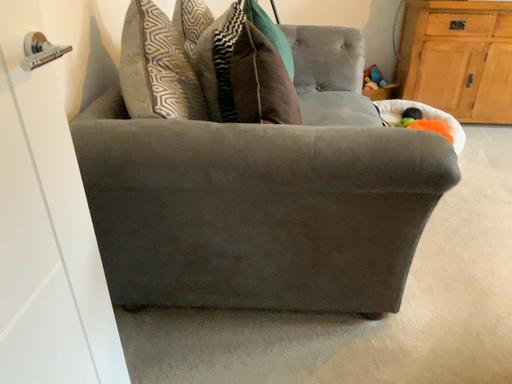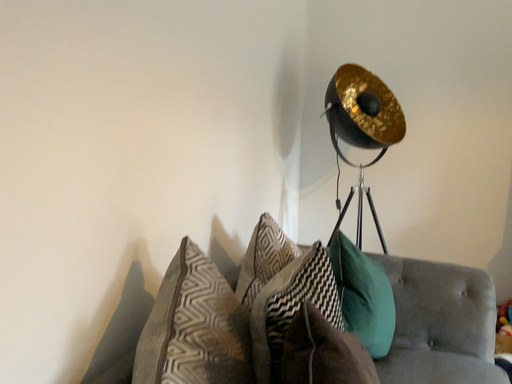
Question: Which way did the camera rotate in the video?

Choices:
 (A) rotated upward
 (B) rotated downward

Answer: (A)